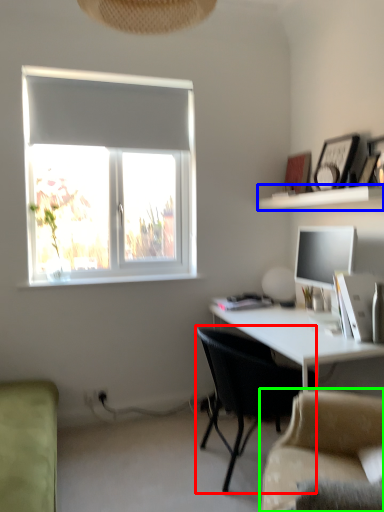
Question: Which object is positioned closest to chair (highlighted by a red box)? Select from shelf (highlighted by a blue box) and studio couch (highlighted by a green box).

Choices:
 (A) shelf
 (B) studio couch

Answer: (B)